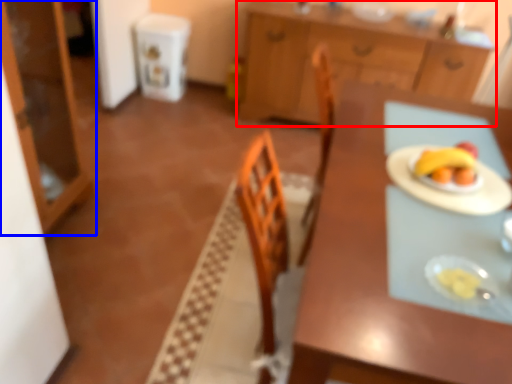
Question: Which object appears farthest to the camera in this image, cabinetry (highlighted by a red box) or cabinetry (highlighted by a blue box)?

Choices:
 (A) cabinetry
 (B) cabinetry

Answer: (A)